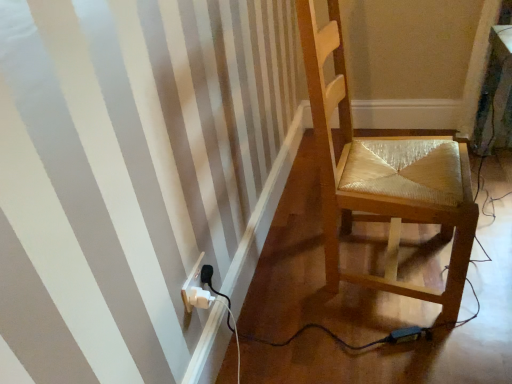
Question: From their relative heights in the image, would you say wooden chair at right is taller or shorter than white plastic electrical outlet at lower left?

Choices:
 (A) short
 (B) tall

Answer: (B)

Question: From the image's perspective, is wooden chair at right above or below white plastic electrical outlet at lower left?

Choices:
 (A) below
 (B) above

Answer: (B)

Question: In terms of size, does wooden chair at right appear bigger or smaller than white plastic electrical outlet at lower left?

Choices:
 (A) small
 (B) big

Answer: (B)

Question: From a real-world perspective, relative to wooden chair at right, is white plastic electrical outlet at lower left vertically above or below?

Choices:
 (A) below
 (B) above

Answer: (A)

Question: From the image's perspective, is white plastic electrical outlet at lower left above or below wooden chair at right?

Choices:
 (A) above
 (B) below

Answer: (B)

Question: Considering the positions of white plastic electrical outlet at lower left and wooden chair at right in the image, is white plastic electrical outlet at lower left taller or shorter than wooden chair at right?

Choices:
 (A) short
 (B) tall

Answer: (A)

Question: Considering their positions, is white plastic electrical outlet at lower left located in front of or behind wooden chair at right?

Choices:
 (A) front
 (B) behind

Answer: (B)